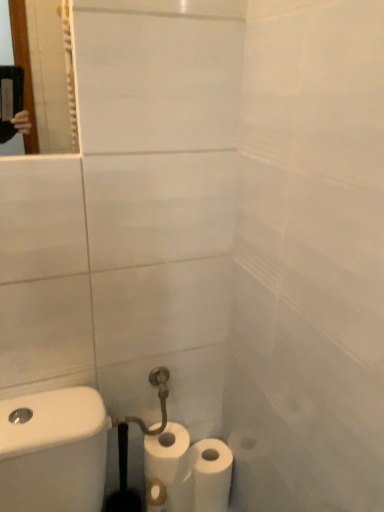
Question: Should I look upward or downward to see white matte toilet paper at lower center, the second toilet paper viewed from the left?

Choices:
 (A) down
 (B) up

Answer: (A)

Question: From a real-world perspective, is white matte toilet paper at lower center, arranged as the first toilet paper when viewed from the right, beneath white matte toilet paper at lower center, the 1th toilet paper in the left-to-right sequence?

Choices:
 (A) yes
 (B) no

Answer: (A)

Question: Is white matte toilet paper at lower center, arranged as the first toilet paper when viewed from the right, to the right of white matte toilet paper at lower center, the second toilet paper viewed from the right, from the viewer's perspective?

Choices:
 (A) yes
 (B) no

Answer: (A)

Question: Is white matte toilet paper at lower center, the second toilet paper viewed from the left, not within white matte toilet paper at lower center, the second toilet paper viewed from the right?

Choices:
 (A) yes
 (B) no

Answer: (A)

Question: Considering the relative sizes of white matte toilet paper at lower center, the second toilet paper viewed from the left, and white matte toilet paper at lower center, the second toilet paper viewed from the right, in the image provided, is white matte toilet paper at lower center, the second toilet paper viewed from the left, smaller than white matte toilet paper at lower center, the second toilet paper viewed from the right,?

Choices:
 (A) yes
 (B) no

Answer: (A)

Question: Is white matte toilet paper at lower center, the second toilet paper viewed from the right, completely or partially inside white matte toilet paper at lower center, the second toilet paper viewed from the left?

Choices:
 (A) no
 (B) yes

Answer: (A)

Question: Are white matte toilet paper at lower center, the second toilet paper viewed from the left, and white matte toilet paper at lower center, the 1th toilet paper in the left-to-right sequence, far apart?

Choices:
 (A) no
 (B) yes

Answer: (A)

Question: From a real-world perspective, is white matte toilet paper at lower center, the 1th toilet paper in the left-to-right sequence, under white matte toilet paper at lower center, the second toilet paper viewed from the left?

Choices:
 (A) no
 (B) yes

Answer: (A)

Question: Considering the relative sizes of white matte toilet paper at lower center, the 1th toilet paper in the left-to-right sequence, and white matte toilet paper at lower center, arranged as the first toilet paper when viewed from the right, in the image provided, is white matte toilet paper at lower center, the 1th toilet paper in the left-to-right sequence, smaller than white matte toilet paper at lower center, arranged as the first toilet paper when viewed from the right,?

Choices:
 (A) yes
 (B) no

Answer: (B)

Question: Is white matte toilet paper at lower center, the second toilet paper viewed from the right, at the right side of white matte toilet paper at lower center, the second toilet paper viewed from the left?

Choices:
 (A) no
 (B) yes

Answer: (A)

Question: Can you confirm if white matte toilet paper at lower center, the second toilet paper viewed from the right, is bigger than white matte toilet paper at lower center, the second toilet paper viewed from the left?

Choices:
 (A) yes
 (B) no

Answer: (A)

Question: Could you tell me if white matte toilet paper at lower center, the second toilet paper viewed from the right, is facing white matte toilet paper at lower center, arranged as the first toilet paper when viewed from the right?

Choices:
 (A) yes
 (B) no

Answer: (B)

Question: From the image's perspective, is white matte toilet paper at lower center, the second toilet paper viewed from the right, above white matte toilet paper at lower center, the second toilet paper viewed from the left?

Choices:
 (A) no
 (B) yes

Answer: (B)

Question: Relative to white matte toilet paper at lower center, the 1th toilet paper in the left-to-right sequence, is white matte toilet paper at lower center, arranged as the first toilet paper when viewed from the right, in front or behind?

Choices:
 (A) front
 (B) behind

Answer: (B)